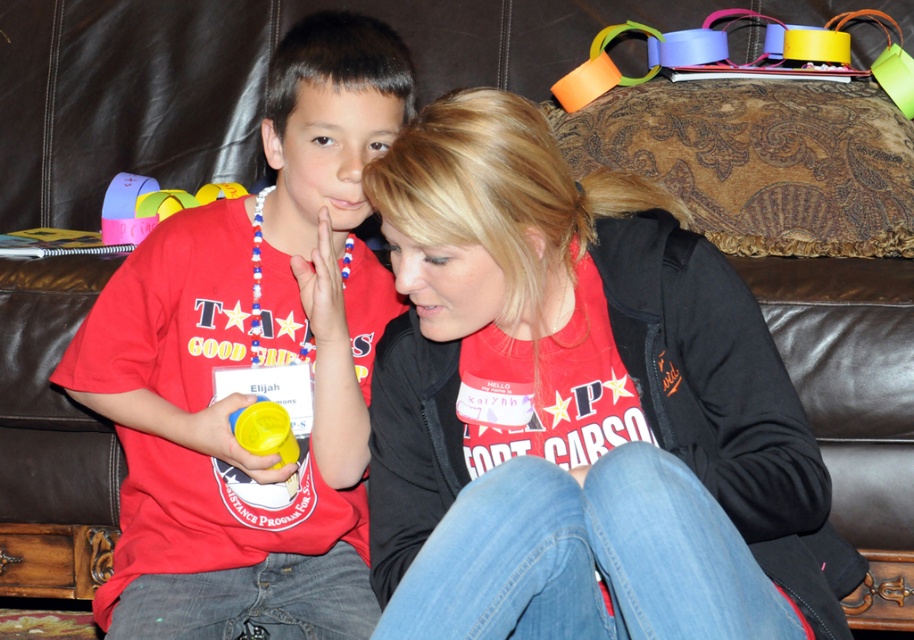
Question: Is matte red shirt at center above multicolored paper chain at upper right?

Choices:
 (A) yes
 (B) no

Answer: (B)

Question: Considering the relative positions of multicolored paper chain at upper right and matte plastic cup at left in the image provided, where is multicolored paper chain at upper right located with respect to matte plastic cup at left?

Choices:
 (A) right
 (B) left

Answer: (A)

Question: Which object appears closest to the camera in this image?

Choices:
 (A) matte red shirt at center
 (B) matte plastic cup at left
 (C) multicolored paper chain at upper right

Answer: (A)

Question: Which of the following is the farthest from the observer?

Choices:
 (A) matte plastic cup at center
 (B) matte plastic cup at left
 (C) matte red shirt at center
 (D) multicolored paper chain at upper right

Answer: (B)

Question: Among these objects, which one is farthest from the camera?

Choices:
 (A) multicolored paper chain at upper right
 (B) matte plastic cup at left
 (C) matte red shirt at center

Answer: (B)

Question: Is matte plastic cup at center below multicolored paper chain at upper right?

Choices:
 (A) no
 (B) yes

Answer: (B)